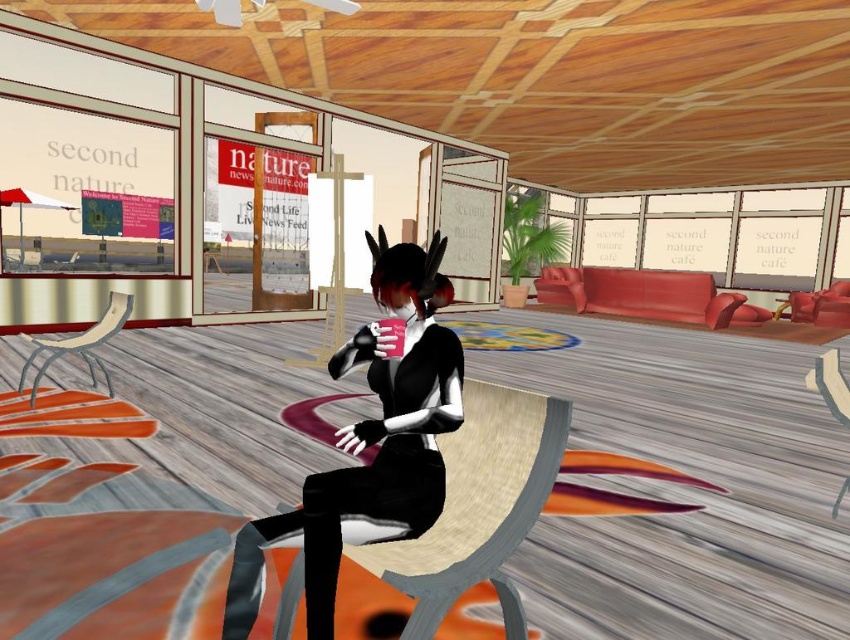
Question: Among these points, which one is farthest from the camera?

Choices:
 (A) 126,310
 (B) 77,259

Answer: (B)

Question: Can you confirm if black matte dress at center is positioned to the left of wooden textured chair at lower right?

Choices:
 (A) yes
 (B) no

Answer: (A)

Question: Does metallic silver chair at left appear on the right side of wooden textured chair at lower right?

Choices:
 (A) yes
 (B) no

Answer: (B)

Question: Estimate the real-world distances between objects in this image. Which object is farther from the black matte dress at center?

Choices:
 (A) wooden textured chair at lower right
 (B) metallic silver chair at center
 (C) metallic silver chair at left

Answer: (B)

Question: Which object appears farthest from the camera in this image?

Choices:
 (A) wooden textured chair at lower right
 (B) metallic silver chair at center
 (C) metallic silver chair at left
 (D) black matte dress at center

Answer: (B)

Question: Does wooden textured chair at lower right have a smaller size compared to metallic silver chair at center?

Choices:
 (A) no
 (B) yes

Answer: (B)